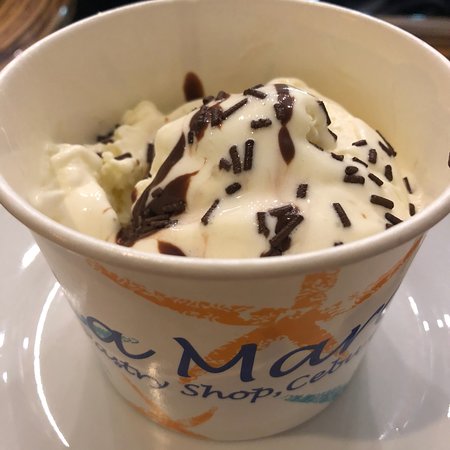
This screenshot has width=450, height=450. I want to click on table, so click(x=13, y=25).